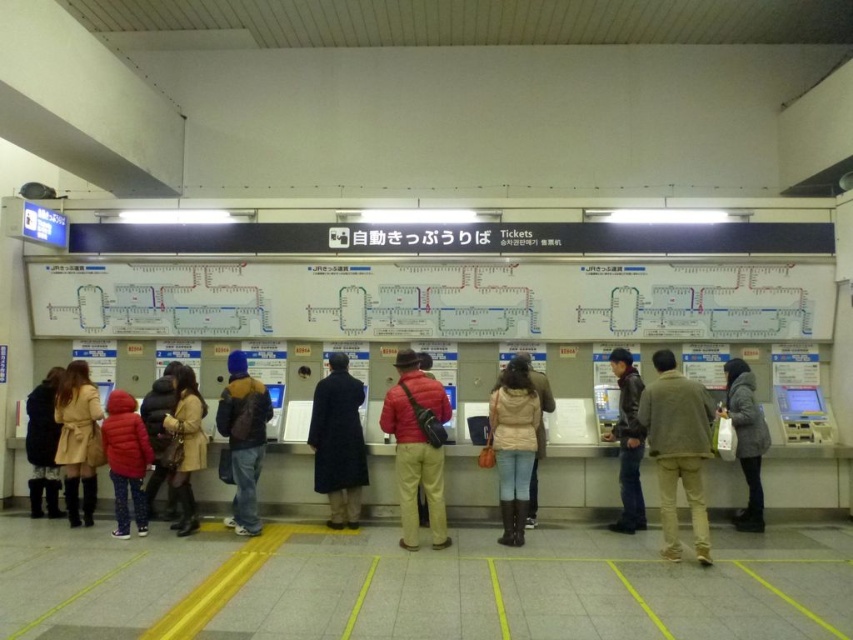
In the scene shown: You are standing in the ticketing area and need to step aside to let someone pass. Given that your light brown leather boots at center are wider than the velvet black coat at lower left, how should you adjust your position to avoid blocking the path?

Since the light brown leather boots at center are wider than the velvet black coat at lower left, you should move your light brown leather boots at center to the side to allow enough space for others to pass without obstruction.

You are a traveler standing in the ticketing area of the train station. You need to place your velvet black coat at lower left and light brown leather boots at center into a nearby storage locker. The locker has a maximum capacity of 0.5 cubic meters. Can both items fit inside the locker together?

The light brown leather boots at center has a larger size compared to velvet black coat at lower left. However, without knowing the exact dimensions of both items, it is impossible to determine if their combined volume exceeds the locker capacity of 0.5 cubic meters. Please check the size labels on the items or measure them before deciding.